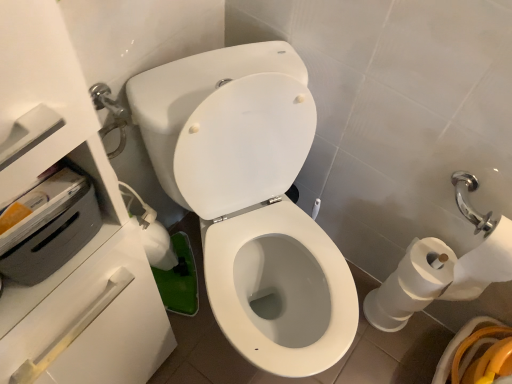
What is the approximate width of white glossy toilet seat at center?

white glossy toilet seat at center is 27.47 inches in width.

The width and height of the screenshot is (512, 384). What are the coordinates of `white glossy toilet seat at center` in the screenshot? It's located at (251, 199).

The width and height of the screenshot is (512, 384). What do you see at coordinates (251, 199) in the screenshot?
I see `white glossy toilet seat at center` at bounding box center [251, 199].

The width and height of the screenshot is (512, 384). What are the coordinates of `white glossy toilet seat at center` in the screenshot? It's located at (251, 199).